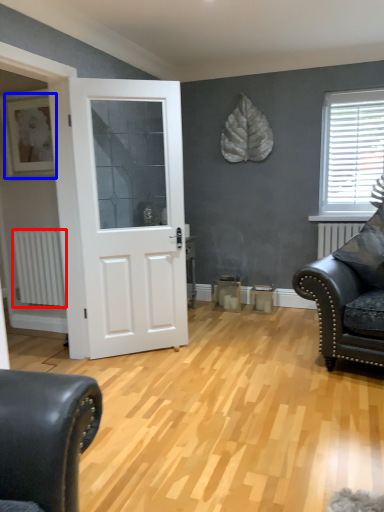
Question: Which object is further to the camera taking this photo, radiator (highlighted by a red box) or picture frame (highlighted by a blue box)?

Choices:
 (A) radiator
 (B) picture frame

Answer: (A)